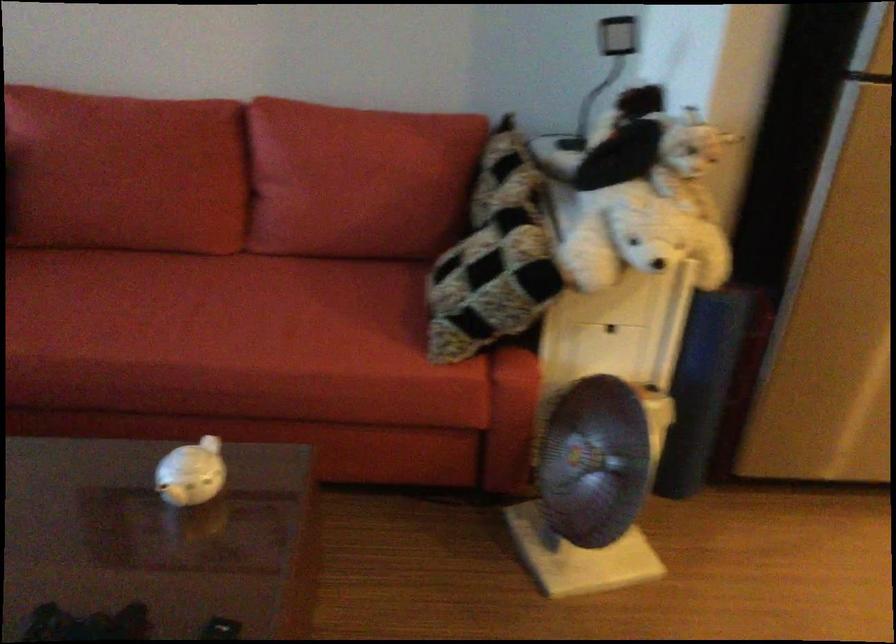
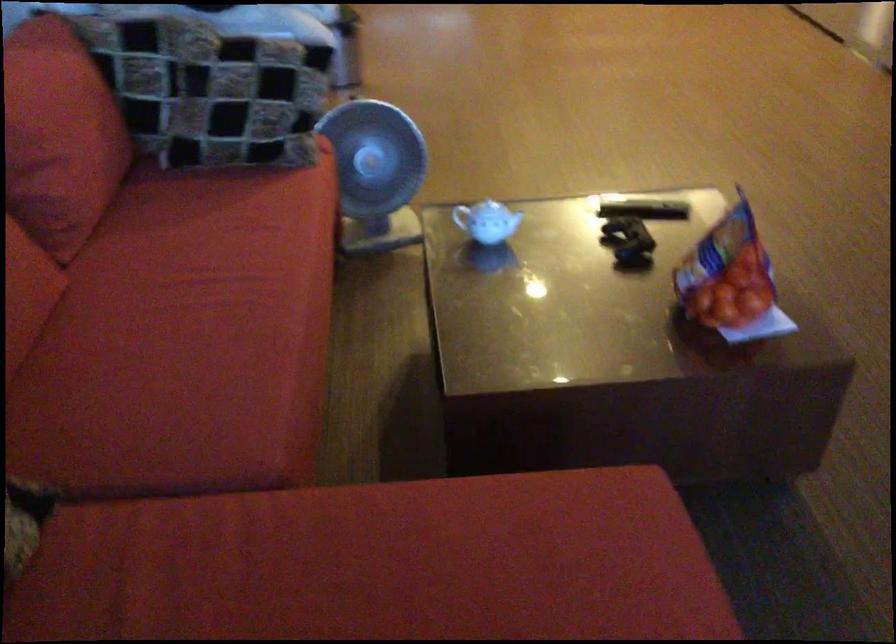
In the second image, find the point that corresponds to [168,464] in the first image.

(487, 220)